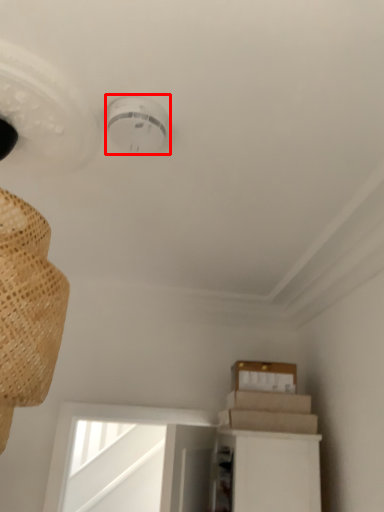
Question: In this image, where is lamp (annotated by the red box) located relative to cardboard box?

Choices:
 (A) left
 (B) right

Answer: (A)